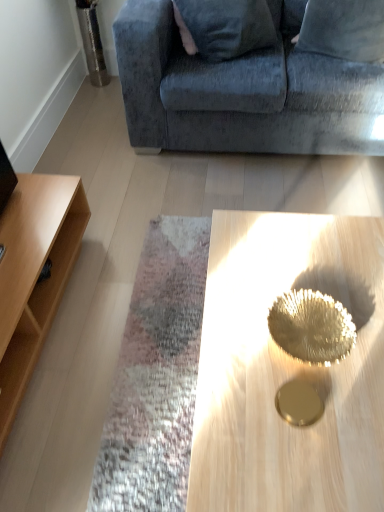
What are the coordinates of `vacant area that lies to the right of light wood shelf at left` in the screenshot? It's located at (133, 317).